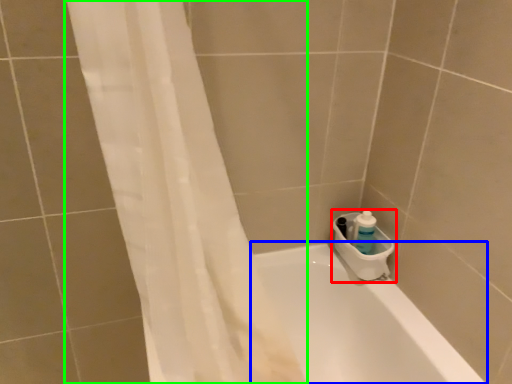
Question: Which object is the closest to the sink (highlighted by a red box)? Choose among these: bathtub (highlighted by a blue box) or shower curtain (highlighted by a green box).

Choices:
 (A) bathtub
 (B) shower curtain

Answer: (A)